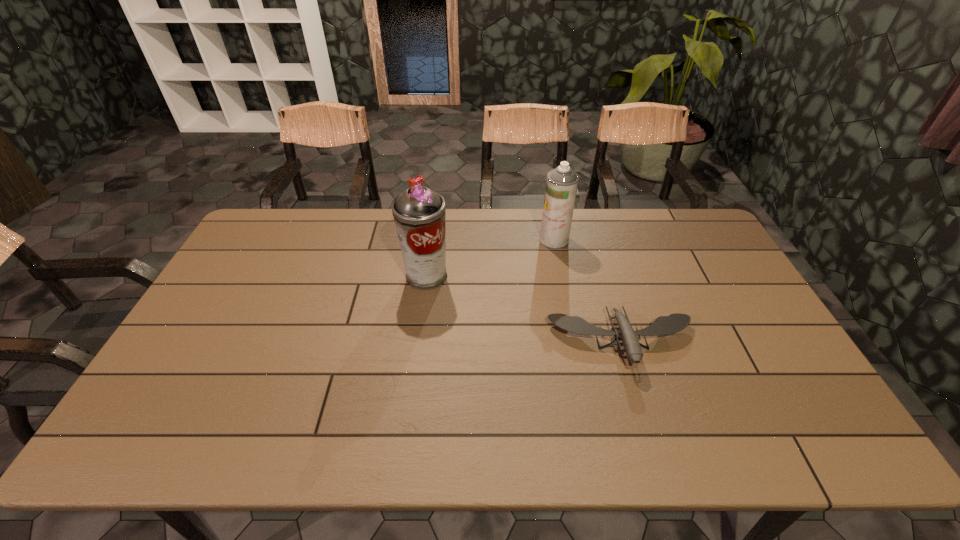
Identify the location of vacant space at the far edge of the desktop. Image resolution: width=960 pixels, height=540 pixels. (507, 227).

At what (x,y) coordinates should I click in order to perform the action: click on free point at the near edge. Please return your answer as a coordinate pair (x, y). Looking at the image, I should click on (703, 444).

The image size is (960, 540). In the image, there is a desktop. Find the location of `vacant area at the left edge`. vacant area at the left edge is located at coordinates (179, 402).

Find the location of a particular element. The height and width of the screenshot is (540, 960). free space at the right edge of the desktop is located at coordinates (710, 289).

In order to click on free space at the far left corner of the desktop in this screenshot , I will do [257, 245].

Where is `free space at the near left corner`? The image size is (960, 540). free space at the near left corner is located at coordinates (155, 421).

Locate an element on the screen. The image size is (960, 540). vacant region between the shortest object and the farther aerosol can is located at coordinates (588, 291).

The image size is (960, 540). Identify the location of free space between the drone and the second tallest object. (588, 291).

This screenshot has width=960, height=540. I want to click on vacant area that lies between the nearer aerosol can and the right aerosol can, so click(x=491, y=258).

Identify the location of vacant area between the drone and the farthest object. This screenshot has width=960, height=540. (588, 291).